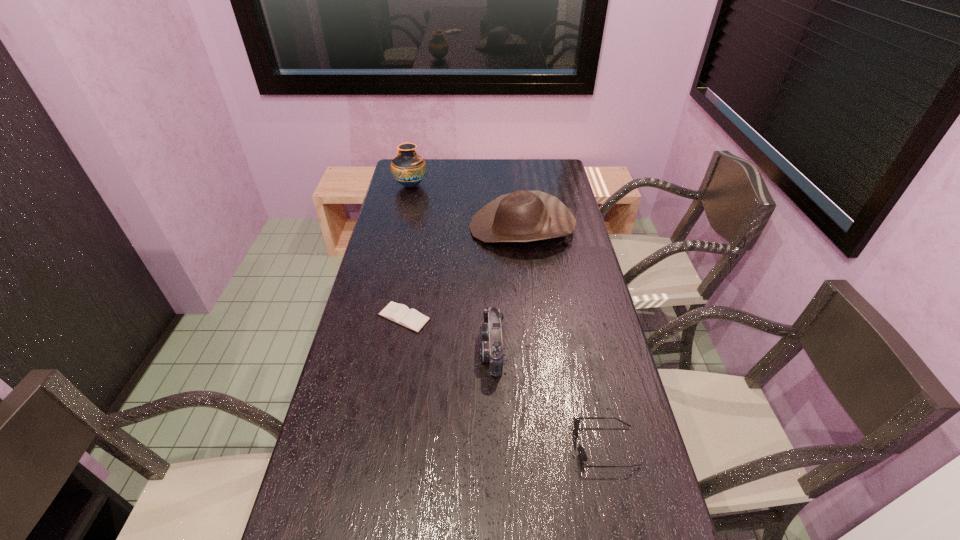
Locate an element on the screen. The width and height of the screenshot is (960, 540). free space between the shortest object and the tallest object is located at coordinates (407, 252).

Where is `vacant point located between the shortest object and the tallest object`? vacant point located between the shortest object and the tallest object is located at coordinates (407, 252).

You are a GUI agent. You are given a task and a screenshot of the screen. Output one action in this format:
    pyautogui.click(x=<x>, y=<y>)
    Task: Click on the empty space between the diary and the sunglasses
    The width and height of the screenshot is (960, 540).
    Given the screenshot: What is the action you would take?
    pyautogui.click(x=505, y=382)

Identify the location of vacant area that lies between the farthest object and the nearest object. The image size is (960, 540). (508, 316).

Locate an element on the screen. This screenshot has width=960, height=540. vacant point located between the camcorder and the second farthest object is located at coordinates (507, 288).

Image resolution: width=960 pixels, height=540 pixels. I want to click on free area in between the farthest object and the camcorder, so click(x=451, y=267).

Find the location of a particular element. This screenshot has height=540, width=960. vacant area that lies between the sunglasses and the tallest object is located at coordinates (508, 316).

I want to click on object identified as the second closest to the pottery, so click(x=400, y=314).

What are the coordinates of `the fourth closest object to the camcorder` in the screenshot? It's located at (408, 168).

Locate an element on the screen. vacant region that satisfies the following two spatial constraints: 1. on the back side of the cowboy hat; 2. on the left side of the shortest object is located at coordinates (420, 228).